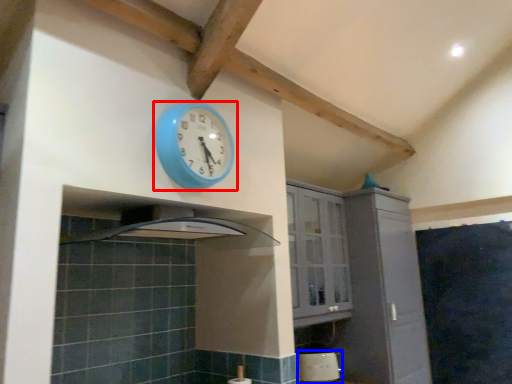
Question: Which of the following is the closest to the observer, wall clock (highlighted by a red box) or appliance (highlighted by a blue box)?

Choices:
 (A) wall clock
 (B) appliance

Answer: (A)